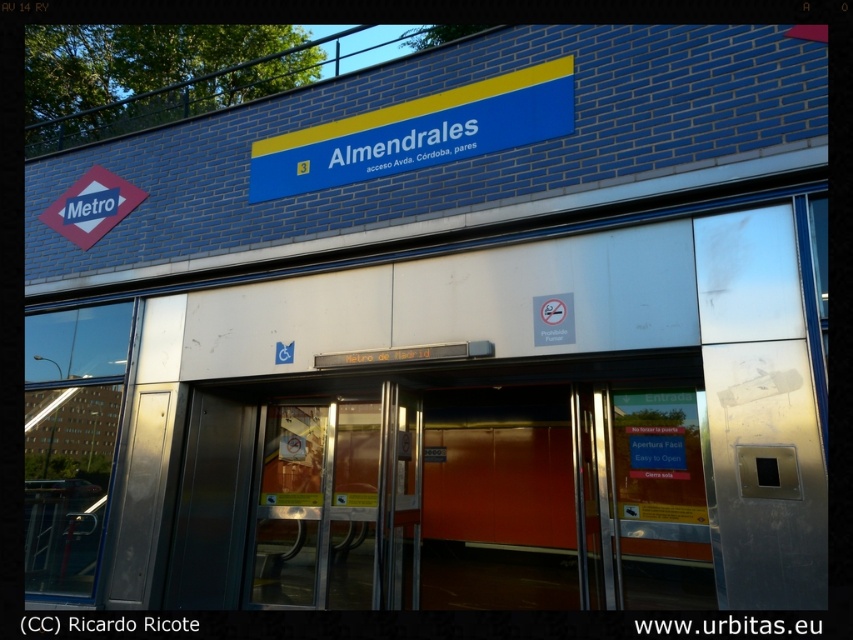
Is blue plastic sign at upper center positioned at the back of matte red diamond at upper left?

That is False.

Is point (403, 108) closer to camera compared to point (119, 200)?

Yes, it is in front of point (119, 200).

Which is in front, point (395, 161) or point (113, 193)?

Positioned in front is point (395, 161).

Locate an element on the screen. The image size is (853, 640). blue plastic sign at upper center is located at coordinates (418, 132).

Does point (374, 419) come behind point (51, 212)?

That is False.

Find the location of `transparent glass door at center`. transparent glass door at center is located at coordinates (321, 506).

Is point (253, 570) less distant than point (120, 193)?

Yes, it is in front of point (120, 193).

The width and height of the screenshot is (853, 640). Find the location of `transparent glass door at center`. transparent glass door at center is located at coordinates (321, 506).

Who is lower down, transparent glass door at center or blue plastic sign at upper center?

transparent glass door at center

Between point (329, 552) and point (529, 80), which one is positioned behind?

Point (329, 552)

Locate an element on the screen. The image size is (853, 640). transparent glass door at center is located at coordinates (321, 506).